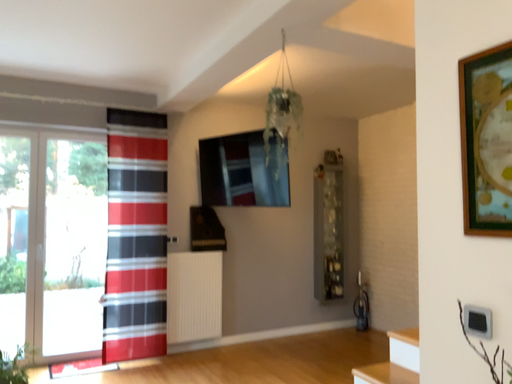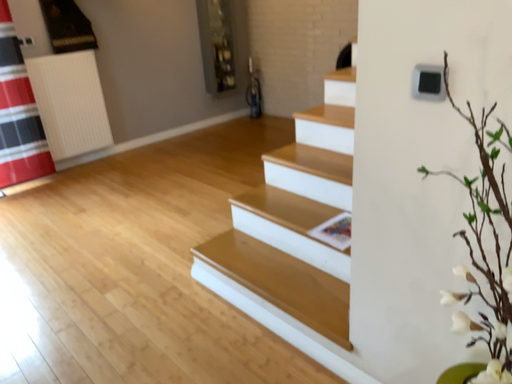
Question: How did the camera likely rotate when shooting the video?

Choices:
 (A) rotated right
 (B) rotated left

Answer: (A)